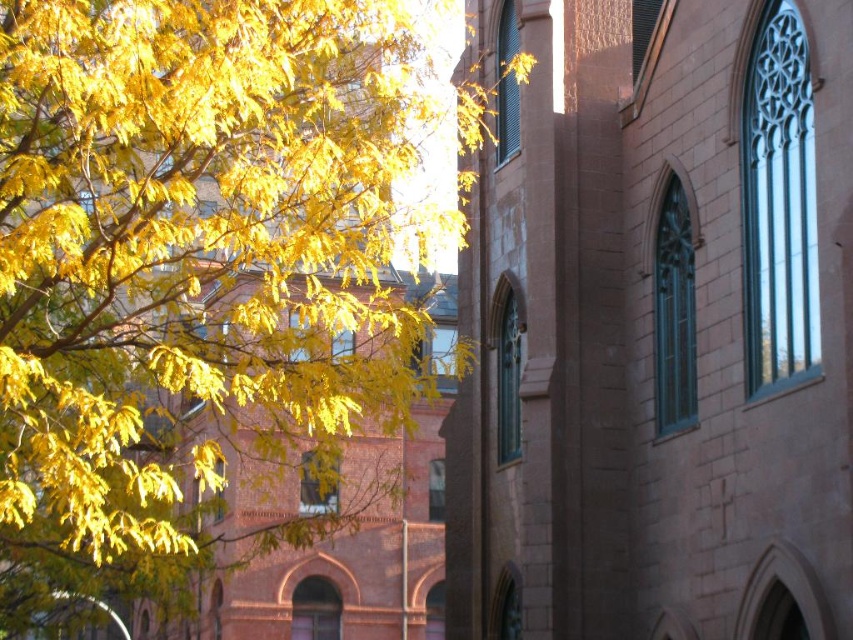
Does brown stone tower at center have a greater height compared to yellow leafy branches at left?

Yes.

Is point (548, 10) farther from viewer compared to point (254, 212)?

Yes, it is.

Identify the location of brown stone tower at center. Image resolution: width=853 pixels, height=640 pixels. (656, 324).

The image size is (853, 640). Identify the location of brown stone tower at center. (656, 324).